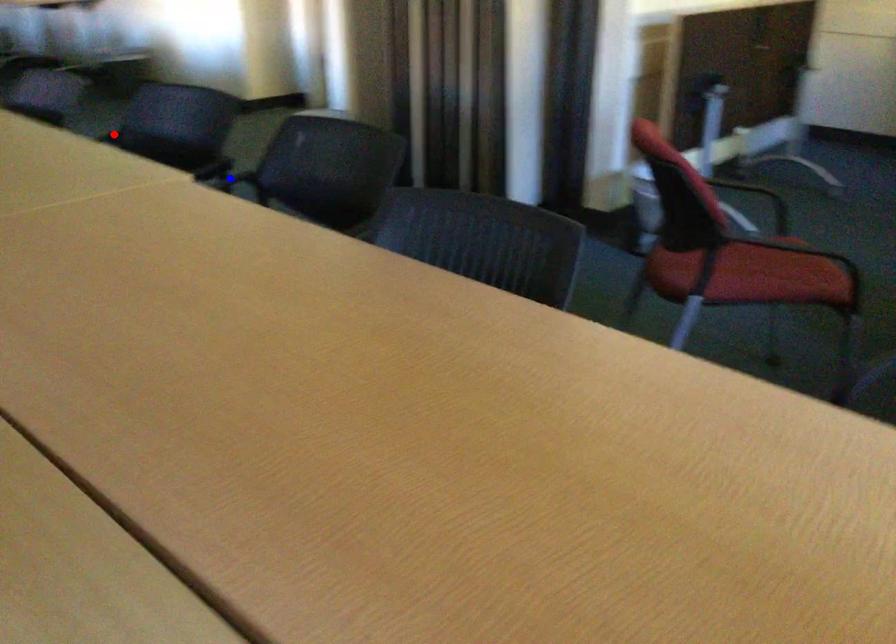
Question: Which of the two points in the image is closer to the camera?

Choices:
 (A) Blue point is closer.
 (B) Red point is closer.

Answer: (A)